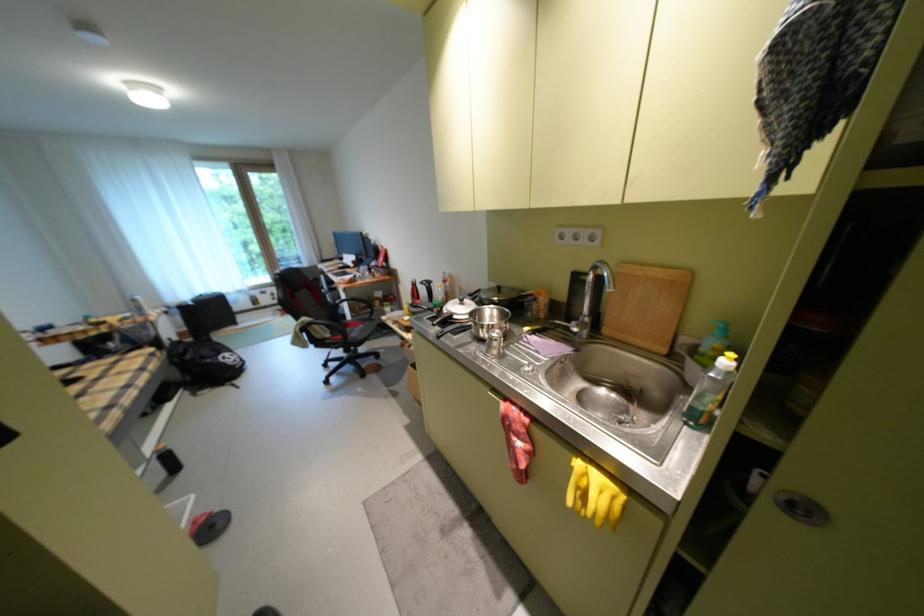
Locate an element on the screen. silver pot handle is located at coordinates (488, 320).